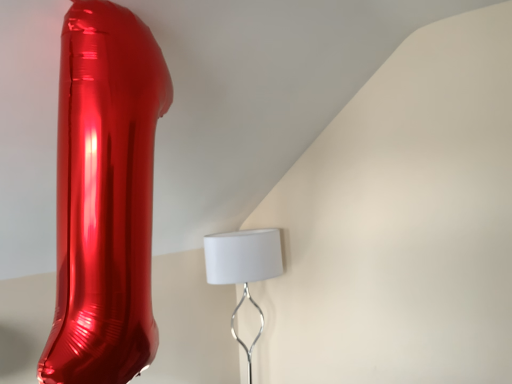
Question: Is white matte lampshade at center beside shiny metallic balloon at left?

Choices:
 (A) yes
 (B) no

Answer: (B)

Question: From a real-world perspective, is white matte lampshade at center positioned over shiny metallic balloon at left based on gravity?

Choices:
 (A) yes
 (B) no

Answer: (B)

Question: Is white matte lampshade at center oriented away from shiny metallic balloon at left?

Choices:
 (A) no
 (B) yes

Answer: (A)

Question: Would you consider white matte lampshade at center to be distant from shiny metallic balloon at left?

Choices:
 (A) no
 (B) yes

Answer: (B)

Question: Considering the relative sizes of white matte lampshade at center and shiny metallic balloon at left in the image provided, is white matte lampshade at center bigger than shiny metallic balloon at left?

Choices:
 (A) no
 (B) yes

Answer: (A)

Question: Does white matte lampshade at center appear on the left side of shiny metallic balloon at left?

Choices:
 (A) no
 (B) yes

Answer: (A)

Question: Is shiny metallic balloon at left bigger than white matte lampshade at center?

Choices:
 (A) no
 (B) yes

Answer: (B)

Question: Is shiny metallic balloon at left positioned with its back to white matte lampshade at center?

Choices:
 (A) yes
 (B) no

Answer: (B)

Question: Would you consider shiny metallic balloon at left to be distant from white matte lampshade at center?

Choices:
 (A) no
 (B) yes

Answer: (B)

Question: Is shiny metallic balloon at left at the right side of white matte lampshade at center?

Choices:
 (A) no
 (B) yes

Answer: (A)

Question: Can you confirm if shiny metallic balloon at left is taller than white matte lampshade at center?

Choices:
 (A) yes
 (B) no

Answer: (A)

Question: Does shiny metallic balloon at left have a lesser height compared to white matte lampshade at center?

Choices:
 (A) no
 (B) yes

Answer: (A)

Question: From a real-world perspective, is shiny metallic balloon at left above or below white matte lampshade at center?

Choices:
 (A) above
 (B) below

Answer: (A)